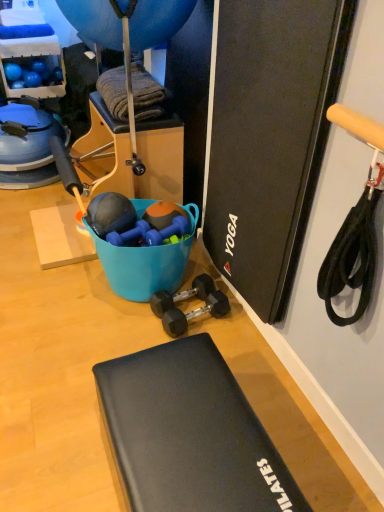
Question: Considering their positions, is black rubber exercise mat at lower center located in front of or behind blue rubber balloon at upper center?

Choices:
 (A) front
 (B) behind

Answer: (A)

Question: Is black rubber exercise mat at lower center wider or thinner than blue rubber balloon at upper center?

Choices:
 (A) thin
 (B) wide

Answer: (A)

Question: Estimate the real-world distances between objects in this image. Which object is farther from the blue rubber balloon at upper center?

Choices:
 (A) black rubber exercise mat at lower center
 (B) black rubber dumbbells at center, arranged as the 2th dumbbell when viewed from the top
 (C) black rubber dumbbell at center, which is counted as the 1th dumbbell, starting from the bottom
 (D) blue rubber dumbbell at center, placed as the 3th dumbbell when sorted from bottom to top

Answer: (A)

Question: Considering the real-world distances, which object is farthest from the blue rubber balloon at upper center?

Choices:
 (A) blue rubber dumbbell at center, placed as the first dumbbell when sorted from top to bottom
 (B) black rubber dumbbells at center, which is the 2th dumbbell from bottom to top
 (C) black rubber exercise mat at lower center
 (D) black rubber dumbbell at center, which is counted as the 1th dumbbell, starting from the bottom

Answer: (C)